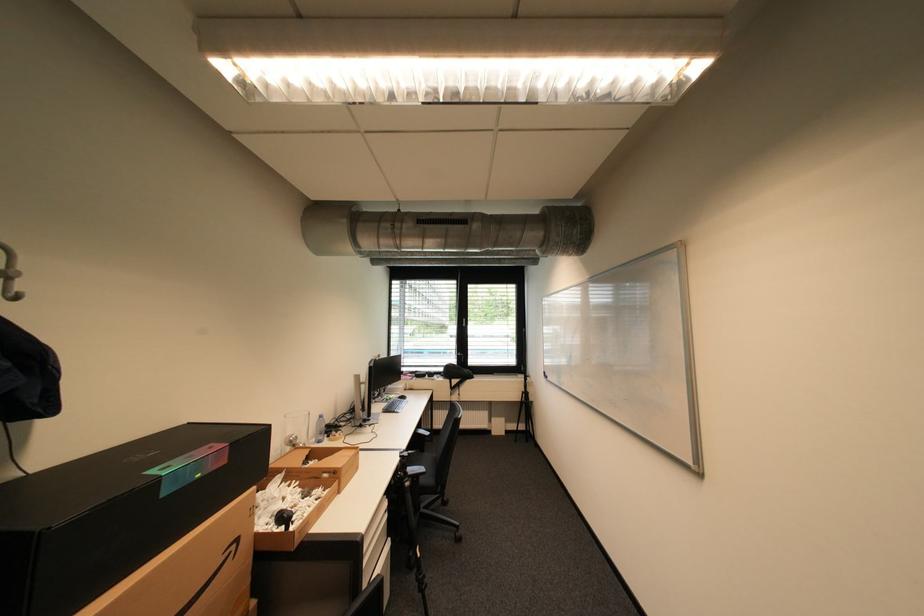
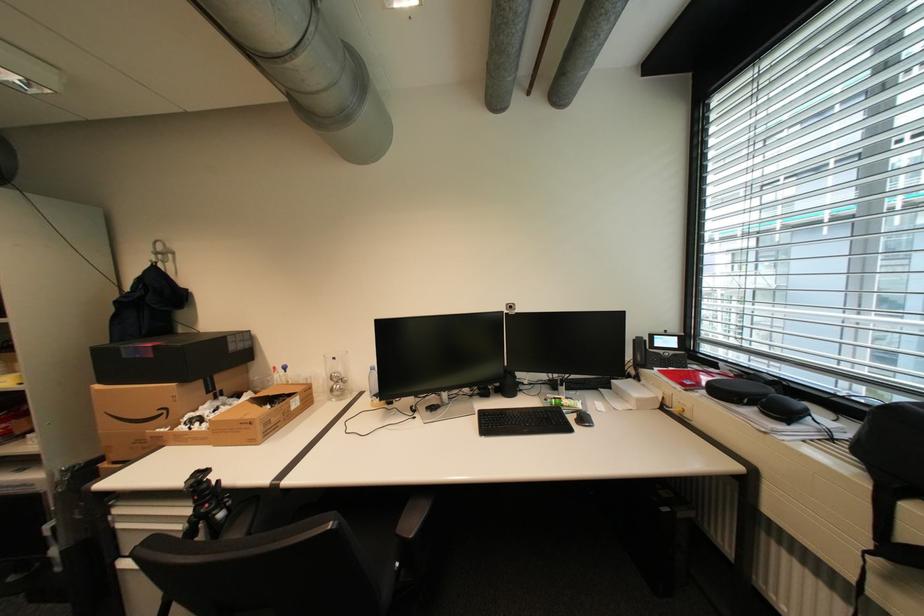
Find the pixel in the second image that matches pixel 242 546 in the first image.

(174, 411)